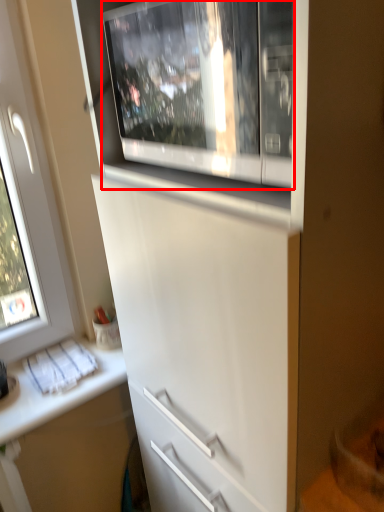
Question: In this image, where is home appliance (annotated by the red box) located relative to counter top?

Choices:
 (A) left
 (B) right

Answer: (B)